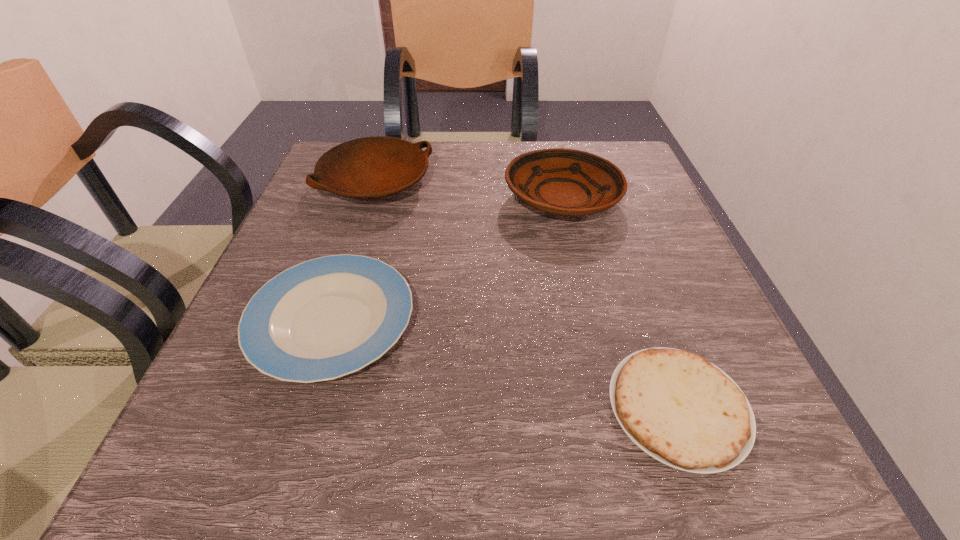
The height and width of the screenshot is (540, 960). What are the coordinates of `free space between the tortilla and the shortest plate` in the screenshot? It's located at (505, 365).

Identify the location of free space between the rightmost plate and the shortest plate. This screenshot has width=960, height=540. (447, 261).

Point out which object is positioned as the second nearest to the shortest object. Please provide its 2D coordinates. Your answer should be formatted as a tuple, i.e. [(x, y)], where the tuple contains the x and y coordinates of a point satisfying the conditions above.

[(567, 182)]

Where is `object that is the second closest to the tortilla`? This screenshot has width=960, height=540. object that is the second closest to the tortilla is located at coordinates (567, 182).

Where is `the closest plate to the rightmost plate`? the closest plate to the rightmost plate is located at coordinates (370, 167).

Where is `plate that stands as the third closest to the shortest object`? plate that stands as the third closest to the shortest object is located at coordinates (370, 167).

What are the coordinates of `vacant point that satisfies the following two spatial constraints: 1. on the back side of the nearest plate; 2. on the right side of the rightmost plate` in the screenshot? It's located at (372, 198).